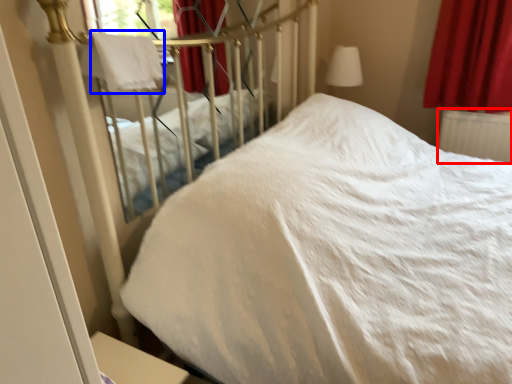
Question: Which of the following is the closest to the observer, radiator (highlighted by a red box) or blanket (highlighted by a blue box)?

Choices:
 (A) radiator
 (B) blanket

Answer: (B)